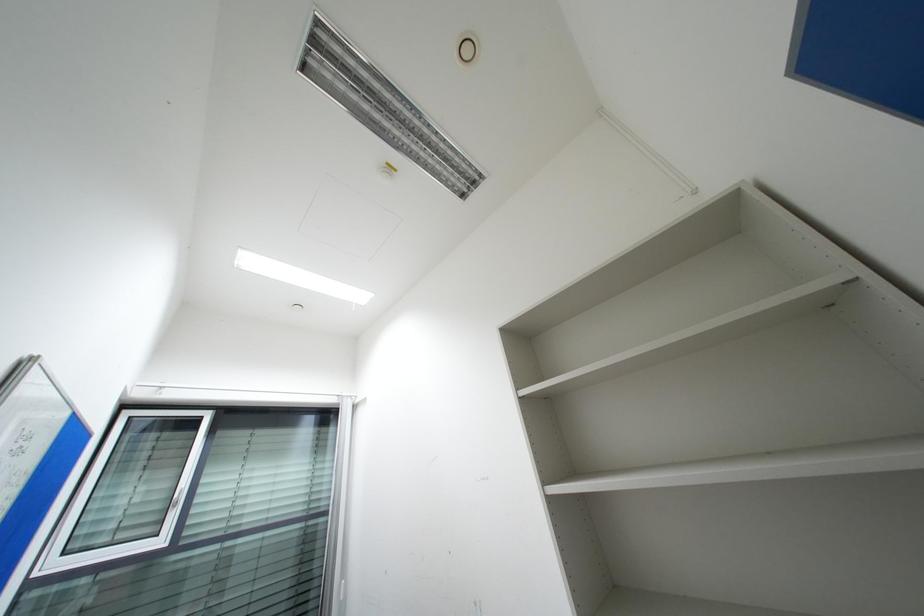
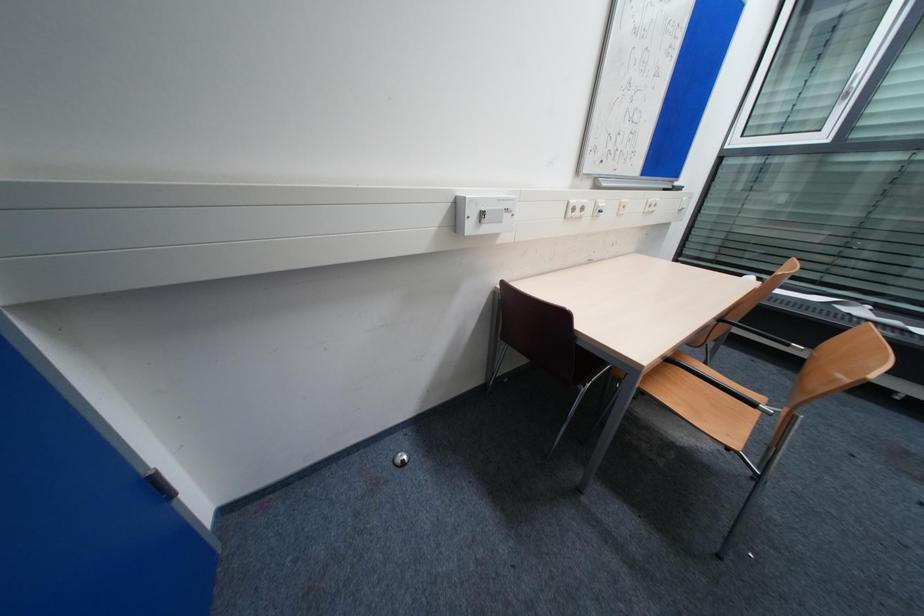
Based on the continuous images, in which direction is the camera rotating?

The rotation direction of the camera is left-down.